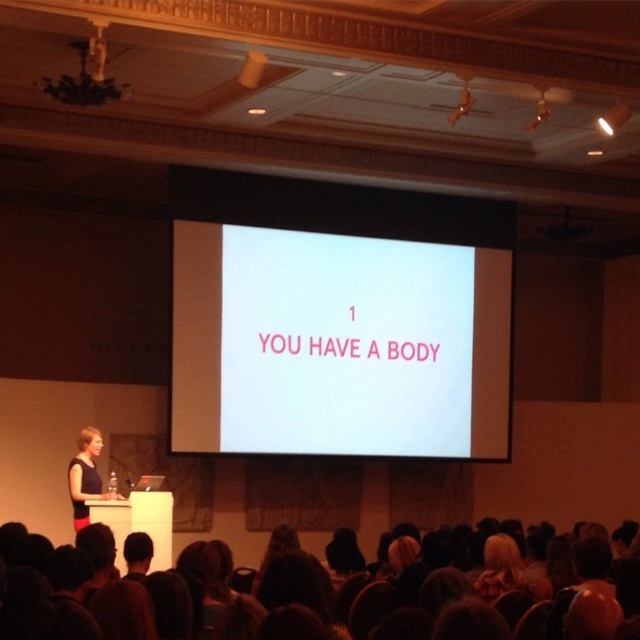
Is white matte projection screen at center thinner than blonde hair at lower center?

No.

Who is higher up, white matte projection screen at center or blonde hair at lower center?

Positioned higher is white matte projection screen at center.

The image size is (640, 640). What do you see at coordinates (337, 344) in the screenshot?
I see `white matte projection screen at center` at bounding box center [337, 344].

Where is `white matte projection screen at center`? This screenshot has width=640, height=640. white matte projection screen at center is located at coordinates (337, 344).

Is white matte projection screen at center thinner than dark hair at lower center?

No.

Is white matte projection screen at center above dark hair at lower center?

Correct, white matte projection screen at center is located above dark hair at lower center.

Who is more forward, (x=310, y=396) or (x=518, y=589)?

Point (x=518, y=589) is more forward.

Locate an element on the screen. This screenshot has height=640, width=640. white matte projection screen at center is located at coordinates (337, 344).

Can you confirm if dark hair at lower center is wider than blonde hair at lower center?

Indeed, dark hair at lower center has a greater width compared to blonde hair at lower center.

Does point (61, 609) lie behind point (516, 557)?

No, (61, 609) is in front of (516, 557).

Between point (285, 582) and point (502, 572), which one is positioned behind?

Positioned behind is point (502, 572).

This screenshot has height=640, width=640. In order to click on dark hair at lower center in this screenshot , I will do `click(93, 595)`.